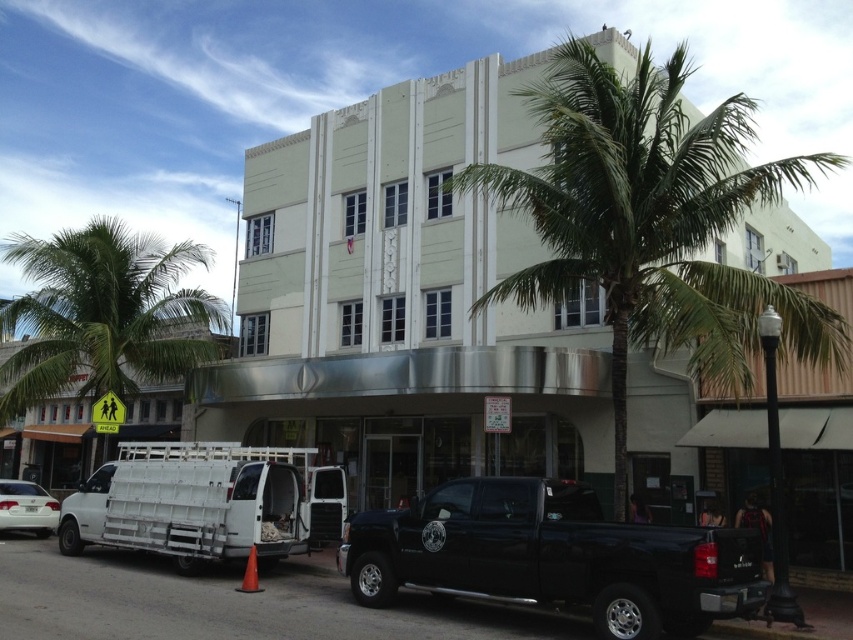
Consider the image. Who is more distant from viewer, (746, 531) or (4, 486)?

The point (4, 486) is behind.

Is point (492, 484) more distant than point (47, 524)?

No.

Between point (572, 563) and point (19, 481), which one is positioned behind?

The point (19, 481) is behind.

I want to click on black glossy truck at lower right, so [x=553, y=556].

Can you confirm if green leafy palm tree at center is bigger than green leafy palm tree at left?

Indeed, green leafy palm tree at center has a larger size compared to green leafy palm tree at left.

In the scene shown: Does green leafy palm tree at center have a greater height compared to green leafy palm tree at left?

Yes.

Is point (732, 384) closer to camera compared to point (25, 368)?

Yes, it is.

This screenshot has width=853, height=640. In order to click on green leafy palm tree at center in this screenshot , I will do `click(651, 221)`.

Is green leafy palm tree at left taller than white matte sedan at lower left?

Indeed, green leafy palm tree at left has a greater height compared to white matte sedan at lower left.

Is green leafy palm tree at left positioned before white matte sedan at lower left?

No, green leafy palm tree at left is further to the viewer.

Measure the distance between green leafy palm tree at left and camera.

They are 17.57 meters apart.

Where is `green leafy palm tree at left`? green leafy palm tree at left is located at coordinates (103, 314).